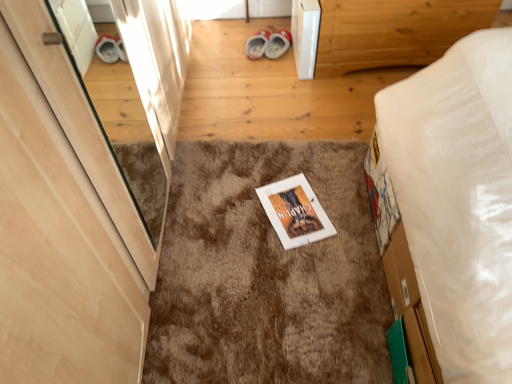
What do you see at coordinates (385, 32) in the screenshot?
I see `wooden bed frame at upper right` at bounding box center [385, 32].

Describe the element at coordinates (257, 44) in the screenshot. I see `red suede shoes at center` at that location.

Describe the element at coordinates (267, 273) in the screenshot. This screenshot has width=512, height=384. I see `brown shaggy carpet at center` at that location.

In order to click on light wood door at left in this screenshot , I will do `click(59, 223)`.

Is wooden bed frame at upper right positioned far away from brown shaggy carpet at center?

wooden bed frame at upper right is actually quite close to brown shaggy carpet at center.

Looking at this image, from the image's perspective, which object appears higher, wooden bed frame at upper right or brown shaggy carpet at center?

wooden bed frame at upper right, from the image's perspective.

From a real-world perspective, who is located higher, wooden bed frame at upper right or brown shaggy carpet at center?

wooden bed frame at upper right is physically above.

What's the angular difference between wooden bed frame at upper right and brown shaggy carpet at center's facing directions?

wooden bed frame at upper right and brown shaggy carpet at center are facing 175 degrees away from each other.

Is red suede shoes at center taller or shorter than wooden bed frame at upper right?

Considering their sizes, red suede shoes at center has less height than wooden bed frame at upper right.

From a real-world perspective, is red suede shoes at center on top of wooden bed frame at upper right?

No.

From the picture: Can you confirm if red suede shoes at center is smaller than wooden bed frame at upper right?

Correct, red suede shoes at center occupies less space than wooden bed frame at upper right.

Considering the sizes of red suede shoes at center and wooden bed frame at upper right in the image, is red suede shoes at center wider or thinner than wooden bed frame at upper right?

red suede shoes at center is thinner than wooden bed frame at upper right.

Which of these two, red suede shoes at center or brown shaggy carpet at center, stands taller?

Standing taller between the two is red suede shoes at center.

Locate an element on the screen. mat in front of the red suede shoes at center is located at coordinates (267, 273).

Is red suede shoes at center inside or outside of brown shaggy carpet at center?

red suede shoes at center is outside brown shaggy carpet at center.

Does wooden bed frame at upper right turn towards light wood door at left?

Yes, wooden bed frame at upper right is facing light wood door at left.

Is wooden bed frame at upper right completely or partially outside of light wood door at left?

Absolutely, wooden bed frame at upper right is external to light wood door at left.

Based on the photo, does wooden bed frame at upper right have a smaller size compared to light wood door at left?

Incorrect, wooden bed frame at upper right is not smaller in size than light wood door at left.

Which of these two, wooden bed frame at upper right or light wood door at left, stands taller?

light wood door at left.

From a real-world perspective, between light wood door at left and brown shaggy carpet at center, who is vertically lower?

From a 3D spatial view, brown shaggy carpet at center is below.

In the scene shown: How many degrees apart are the facing directions of light wood door at left and brown shaggy carpet at center?

They differ by 88.7 degrees in their facing directions.

Is light wood door at left next to brown shaggy carpet at center and touching it?

No.

Is the depth of light wood door at left greater than that of brown shaggy carpet at center?

That is False.

Does red suede shoes at center have a larger size compared to light wood door at left?

No.

Would you say light wood door at left is part of red suede shoes at center's contents?

No, light wood door at left is not inside red suede shoes at center.

Based on their positions, is red suede shoes at center located to the left or right of light wood door at left?

In the image, red suede shoes at center appears on the right side of light wood door at left.

Based on the photo, is the surface of brown shaggy carpet at center in direct contact with wooden bed frame at upper right?

No, brown shaggy carpet at center is not in contact with wooden bed frame at upper right.

Locate an element on the screen. The width and height of the screenshot is (512, 384). mat on the left of wooden bed frame at upper right is located at coordinates coord(267,273).

Is brown shaggy carpet at center situated inside wooden bed frame at upper right or outside?

brown shaggy carpet at center is outside wooden bed frame at upper right.

You are a GUI agent. You are given a task and a screenshot of the screen. Output one action in this format:
    pyautogui.click(x=<x>, y=<y>)
    Task: Click on the mat that is below the wooden bed frame at upper right (from the image's perspective)
    
    Given the screenshot: What is the action you would take?
    pyautogui.click(x=267, y=273)

Where is `footwear lying on the left of wooden bed frame at upper right`? The width and height of the screenshot is (512, 384). footwear lying on the left of wooden bed frame at upper right is located at coordinates (257, 44).

Looking at the image, which one is located further to wooden bed frame at upper right, red suede shoes at center or brown shaggy carpet at center?

Based on the image, brown shaggy carpet at center appears to be further to wooden bed frame at upper right.

Based on their spatial positions, is wooden bed frame at upper right or brown shaggy carpet at center closer to red suede shoes at center?

wooden bed frame at upper right is positioned closer to the anchor red suede shoes at center.

Looking at this image, considering their positions, is light wood door at left positioned further to red suede shoes at center than brown shaggy carpet at center?

Among the two, light wood door at left is located further to red suede shoes at center.

Estimate the real-world distances between objects in this image. Which object is closer to light wood door at left, wooden bed frame at upper right or red suede shoes at center?

wooden bed frame at upper right is closer to light wood door at left.

Considering their positions, is wooden bed frame at upper right positioned further to brown shaggy carpet at center than red suede shoes at center?

red suede shoes at center lies further to brown shaggy carpet at center than the other object.

Considering their positions, is wooden bed frame at upper right positioned closer to light wood door at left than brown shaggy carpet at center?

Among the two, brown shaggy carpet at center is located nearer to light wood door at left.

When comparing their distances from brown shaggy carpet at center, does light wood door at left or wooden bed frame at upper right seem further?

wooden bed frame at upper right is positioned further to the anchor brown shaggy carpet at center.

Which object lies further to the anchor point brown shaggy carpet at center, red suede shoes at center or wooden bed frame at upper right?

Based on the image, red suede shoes at center appears to be further to brown shaggy carpet at center.

Find the location of a particular element. footwear that lies between wooden bed frame at upper right and brown shaggy carpet at center from top to bottom is located at coordinates (257, 44).

Where is `mat located between light wood door at left and wooden bed frame at upper right in the depth direction`? This screenshot has width=512, height=384. mat located between light wood door at left and wooden bed frame at upper right in the depth direction is located at coordinates pos(267,273).

In order to click on furniture between light wood door at left and red suede shoes at center along the z-axis in this screenshot , I will do `click(385, 32)`.

You are a GUI agent. You are given a task and a screenshot of the screen. Output one action in this format:
    pyautogui.click(x=<x>, y=<y>)
    Task: Click on the mat between light wood door at left and red suede shoes at center along the z-axis
    Image resolution: width=512 pixels, height=384 pixels.
    Given the screenshot: What is the action you would take?
    pyautogui.click(x=267, y=273)